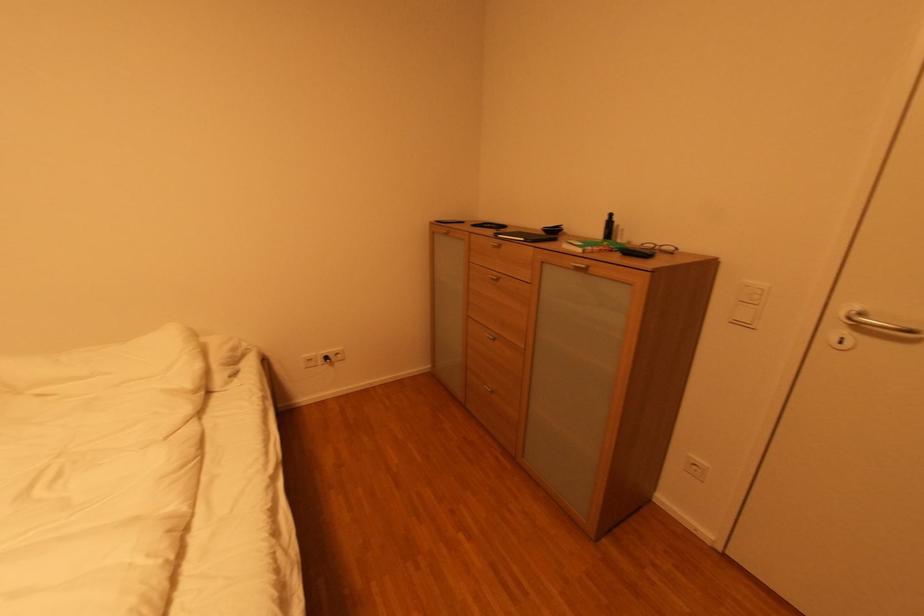
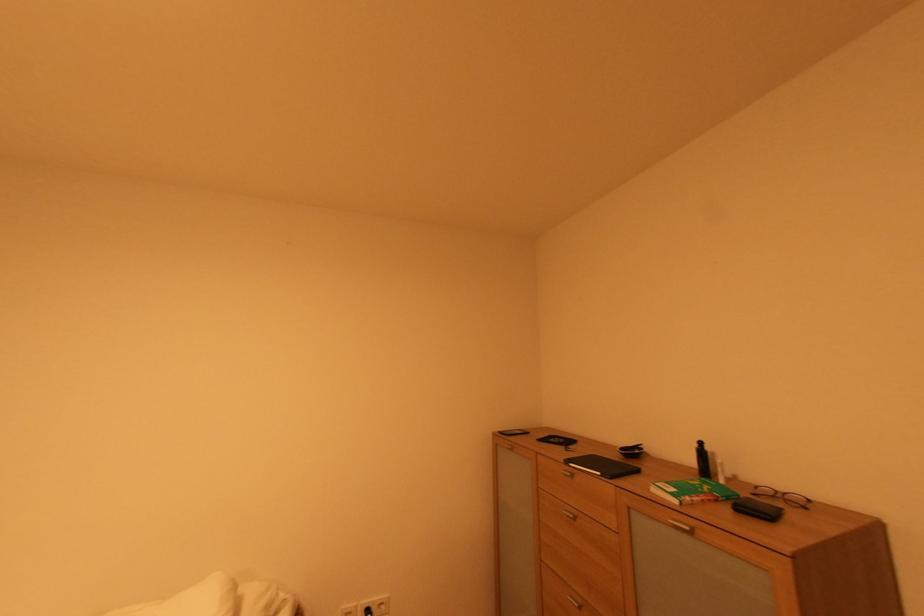
The point at (493, 334) is marked in the first image. Where is the corresponding point in the second image?

(578, 599)